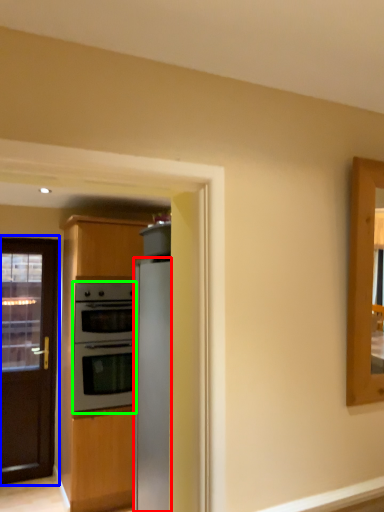
Question: Considering the real-world distances, which object is farthest from refrigerator (highlighted by a red box)? door (highlighted by a blue box) or oven (highlighted by a green box)?

Choices:
 (A) door
 (B) oven

Answer: (A)